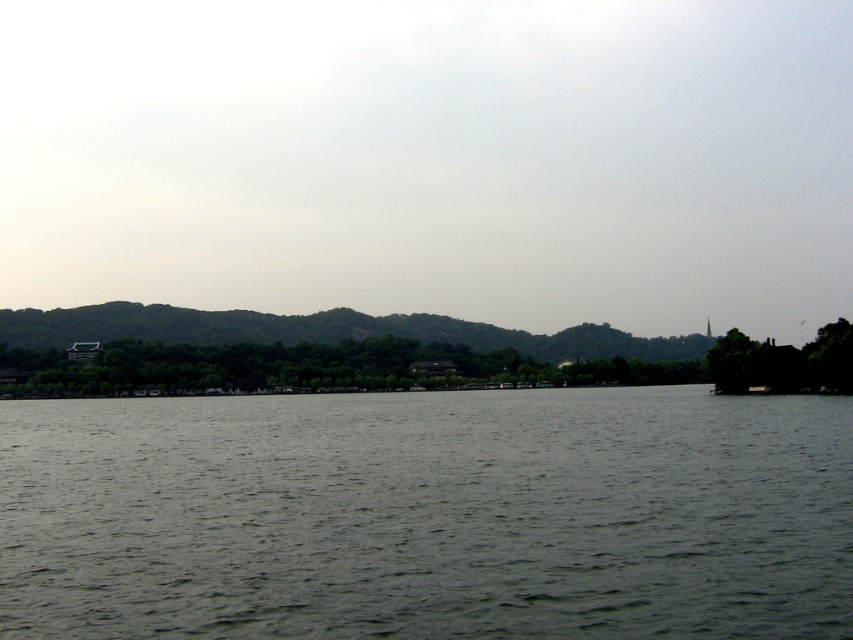
Question: Can you confirm if gray water at center is bigger than green matte tree at right?

Choices:
 (A) no
 (B) yes

Answer: (B)

Question: Which point is farther to the camera?

Choices:
 (A) (498, 554)
 (B) (819, 349)

Answer: (B)

Question: Is gray water at center bigger than green matte tree at right?

Choices:
 (A) no
 (B) yes

Answer: (B)

Question: Where is gray water at center located in relation to green matte tree at right in the image?

Choices:
 (A) right
 (B) left

Answer: (B)